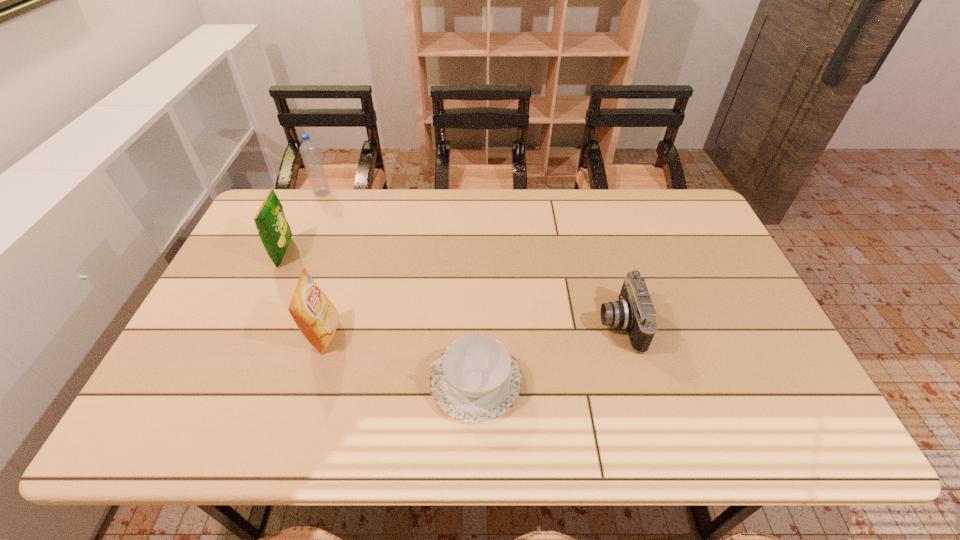
What are the coordinates of `unoccupied area between the second shortest object and the chinaware` in the screenshot? It's located at (548, 353).

Find the location of a particular element. free spot between the fourth tallest object and the water bottle is located at coordinates (470, 258).

Locate an element on the screen. unoccupied area between the second shortest object and the water bottle is located at coordinates (470, 258).

Where is `free space between the water bottle and the third object from left to right`? The width and height of the screenshot is (960, 540). free space between the water bottle and the third object from left to right is located at coordinates (323, 264).

Where is `blank region between the shortest object and the nearer crisp (potato chip)`? This screenshot has width=960, height=540. blank region between the shortest object and the nearer crisp (potato chip) is located at coordinates [400, 358].

In order to click on empty location between the nearer crisp (potato chip) and the water bottle in this screenshot , I will do 323,264.

Identify the location of vacant space that is in between the farther crisp (potato chip) and the water bottle. (303, 223).

At what (x,y) coordinates should I click in order to perform the action: click on vacant space in between the second object from right to left and the second farthest object. Please return your answer as a coordinate pair (x, y). The height and width of the screenshot is (540, 960). Looking at the image, I should click on pos(380,318).

The height and width of the screenshot is (540, 960). Identify the location of object that is the third nearest to the chinaware. (275, 233).

Where is `object identified as the second closest to the chinaware`? This screenshot has height=540, width=960. object identified as the second closest to the chinaware is located at coordinates (316, 317).